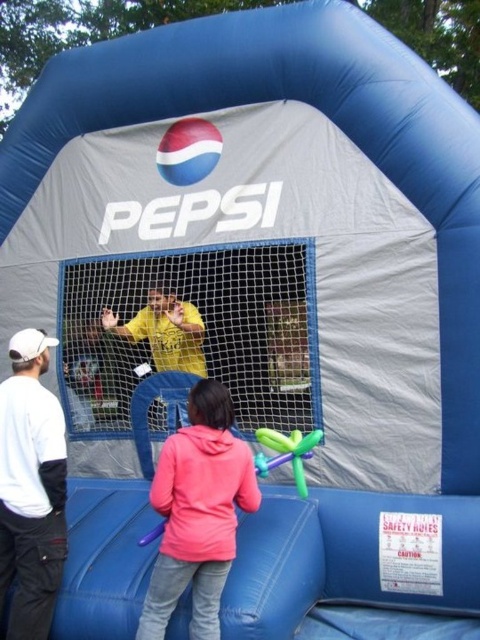
Is white fabric pants at lower left positioned at the back of green rubber balloon animal at lower center?

No, it is in front of green rubber balloon animal at lower center.

Is white fabric pants at lower left positioned in front of green rubber balloon animal at lower center?

Yes, it is.

Describe the element at coordinates (31, 486) in the screenshot. I see `white fabric pants at lower left` at that location.

Where is `white fabric pants at lower left`? The width and height of the screenshot is (480, 640). white fabric pants at lower left is located at coordinates (31, 486).

Which is more to the left, pink fleece jacket at lower center or white fabric pants at lower left?

From the viewer's perspective, white fabric pants at lower left appears more on the left side.

Does pink fleece jacket at lower center have a greater height compared to white fabric pants at lower left?

No, pink fleece jacket at lower center is not taller than white fabric pants at lower left.

The image size is (480, 640). Find the location of `pink fleece jacket at lower center`. pink fleece jacket at lower center is located at coordinates tap(197, 513).

Can you confirm if pink fleece sweatshirt at lower center is positioned above green rubber balloon animal at lower center?

Actually, pink fleece sweatshirt at lower center is below green rubber balloon animal at lower center.

Does pink fleece sweatshirt at lower center appear on the right side of green rubber balloon animal at lower center?

No, pink fleece sweatshirt at lower center is not to the right of green rubber balloon animal at lower center.

Is point (208, 534) positioned before point (283, 445)?

That is True.

Where is `pink fleece sweatshirt at lower center`? This screenshot has height=640, width=480. pink fleece sweatshirt at lower center is located at coordinates (203, 492).